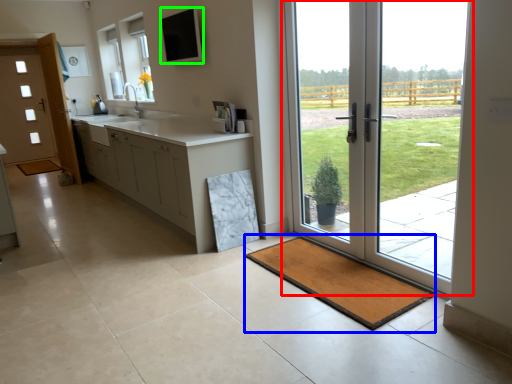
Question: Based on their relative distances, which object is nearer to door (highlighted by a red box)? Choose from bath mat (highlighted by a blue box) and window screen (highlighted by a green box).

Choices:
 (A) bath mat
 (B) window screen

Answer: (A)